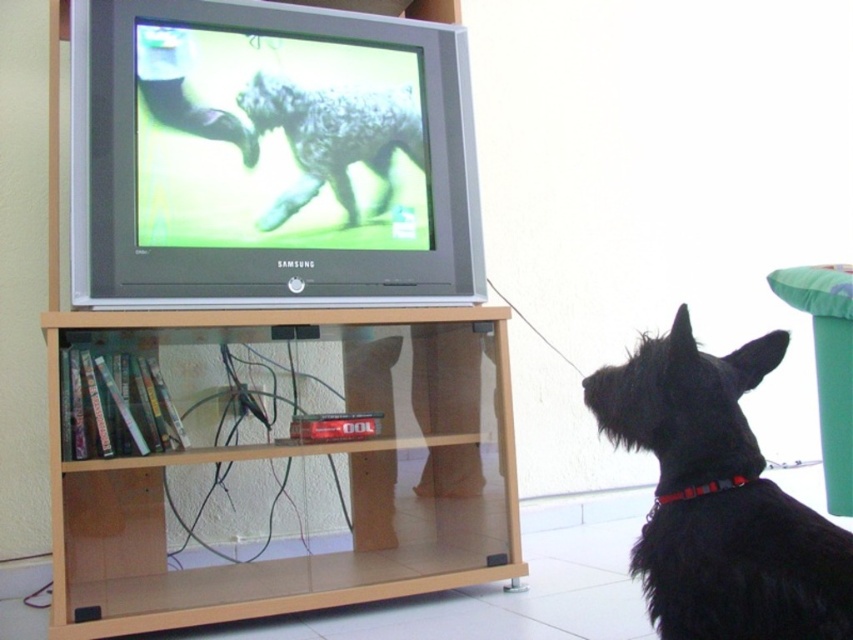
Question: Is transparent glass bookshelf at lower center below fuzzy gray dog at center?

Choices:
 (A) no
 (B) yes

Answer: (B)

Question: Considering the real-world distances, which object is farthest from the black fur dog at lower right?

Choices:
 (A) transparent glass bookshelf at lower center
 (B) fuzzy gray dog at center

Answer: (B)

Question: Does transparent glass bookshelf at lower center appear on the left side of black fur dog at lower right?

Choices:
 (A) no
 (B) yes

Answer: (B)

Question: Considering the real-world distances, which object is closest to the transparent glass bookshelf at lower center?

Choices:
 (A) fuzzy gray dog at center
 (B) black fur dog at lower right

Answer: (A)

Question: Is transparent glass bookshelf at lower center wider than fuzzy gray dog at center?

Choices:
 (A) no
 (B) yes

Answer: (B)

Question: Which of the following is the closest to the observer?

Choices:
 (A) (387, 166)
 (B) (173, 317)
 (C) (641, 388)

Answer: (C)